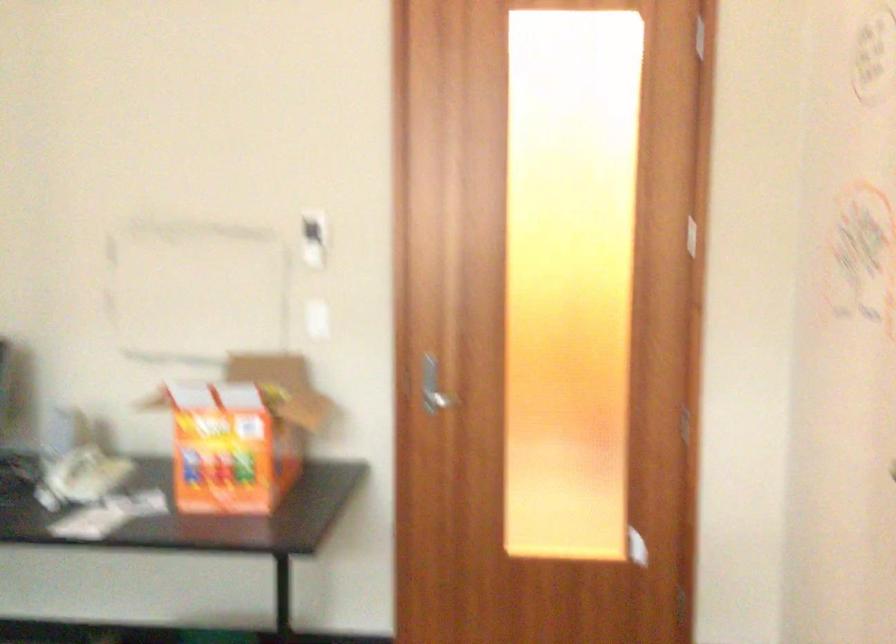
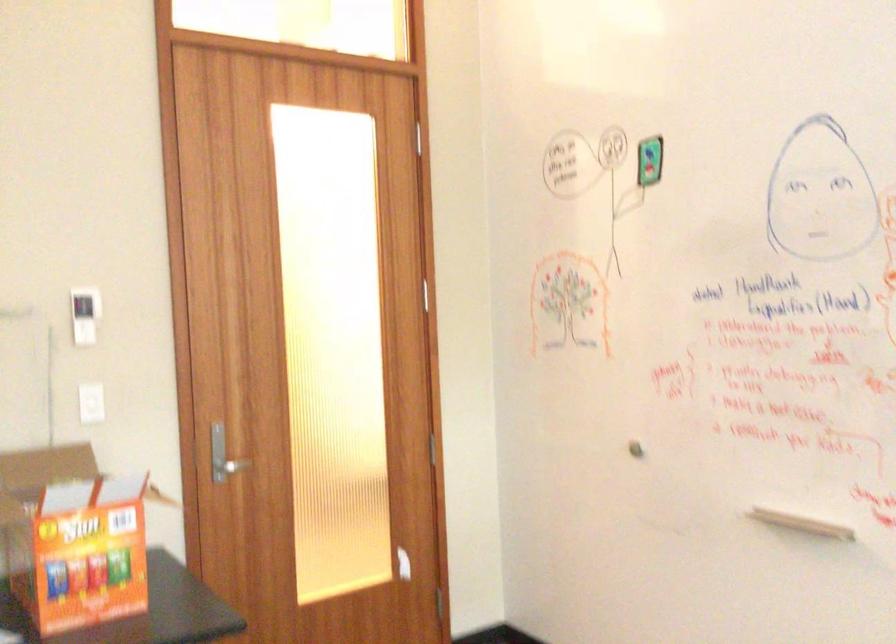
Locate, in the second image, the point that corresponds to pixel 208 436 in the first image.

(72, 538)